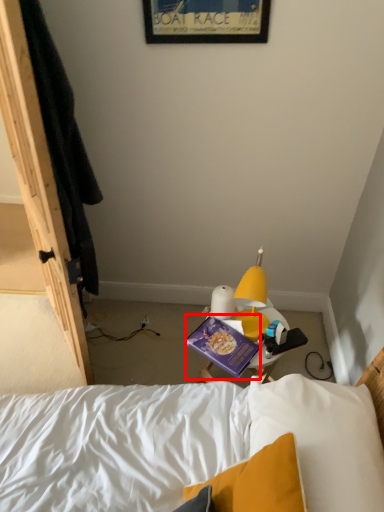
Question: In this image, where is paperback book (annotated by the red box) located relative to picture frame?

Choices:
 (A) left
 (B) right

Answer: (B)